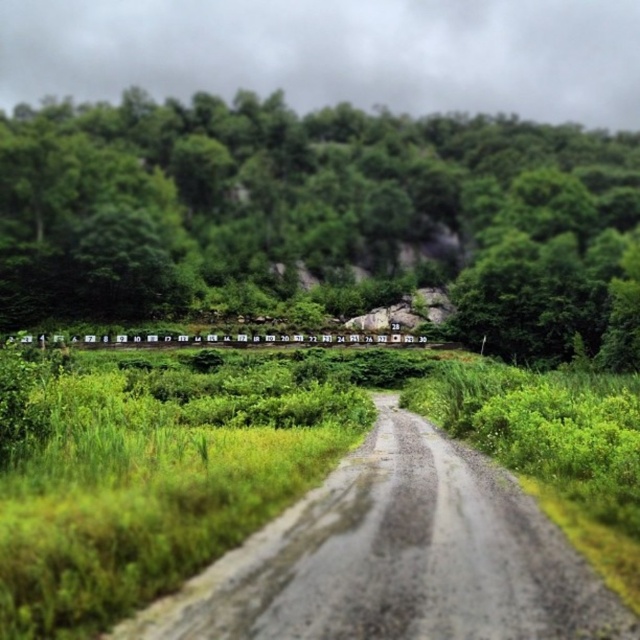
Consider the image. Between green leafy tree at center and gray gravel road at center, which one has more height?

Standing taller between the two is green leafy tree at center.

The width and height of the screenshot is (640, 640). Describe the element at coordinates (310, 212) in the screenshot. I see `green leafy tree at center` at that location.

You are a GUI agent. You are given a task and a screenshot of the screen. Output one action in this format:
    pyautogui.click(x=<x>, y=<y>)
    Task: Click on the green leafy tree at center
    This screenshot has height=640, width=640.
    Given the screenshot: What is the action you would take?
    pyautogui.click(x=310, y=212)